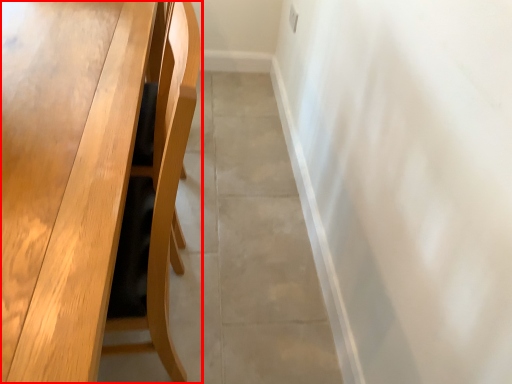
Question: From the image's perspective, considering the relative positions of table (annotated by the red box) and concrete in the image provided, where is table (annotated by the red box) located with respect to the staircase?

Choices:
 (A) above
 (B) below

Answer: (B)